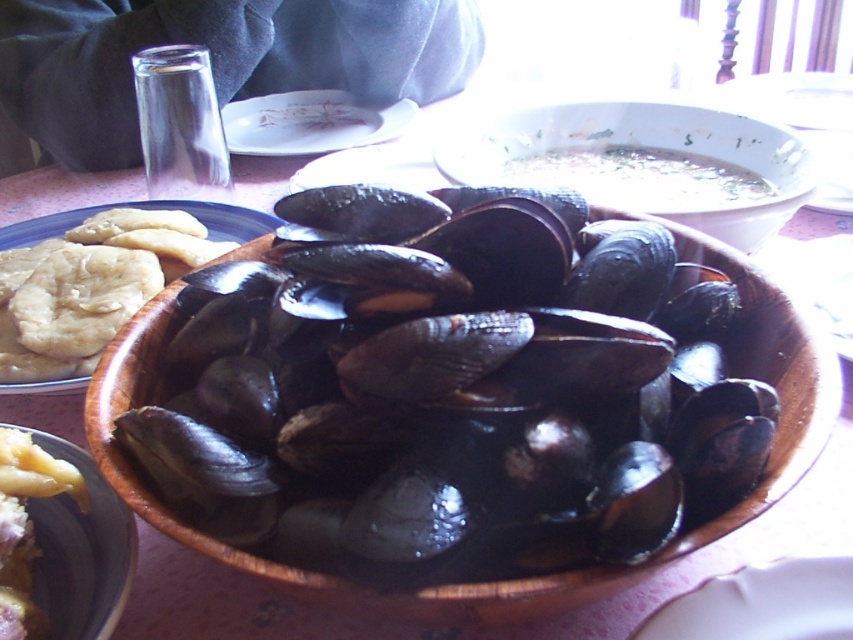
Who is lower down, shiny dark shellfish at center or matte ceramic bowl at center?

matte ceramic bowl at center

Is shiny dark shellfish at center positioned before matte ceramic bowl at center?

Yes, it is.

What do you see at coordinates (444, 413) in the screenshot? I see `shiny dark shellfish at center` at bounding box center [444, 413].

Find the location of a particular element. The height and width of the screenshot is (640, 853). shiny dark shellfish at center is located at coordinates (444, 413).

Who is more distant from viewer, (393,438) or (93,348)?

Point (93,348)

Which of these two, shiny dark shellfish at center or matte yellow flatbread at left, stands shorter?

With less height is matte yellow flatbread at left.

The width and height of the screenshot is (853, 640). Describe the element at coordinates (444, 413) in the screenshot. I see `shiny dark shellfish at center` at that location.

Identify the location of shiny dark shellfish at center. Image resolution: width=853 pixels, height=640 pixels. (444, 413).

Between translucent glass bowl at center and matte yellow flatbread at left, which one appears on the right side from the viewer's perspective?

translucent glass bowl at center

Is translucent glass bowl at center taller than matte yellow flatbread at left?

Correct, translucent glass bowl at center is much taller as matte yellow flatbread at left.

Which is in front, point (795, 145) or point (44, 376)?

Point (44, 376) is in front.

This screenshot has width=853, height=640. In order to click on translucent glass bowl at center in this screenshot , I will do `click(646, 157)`.